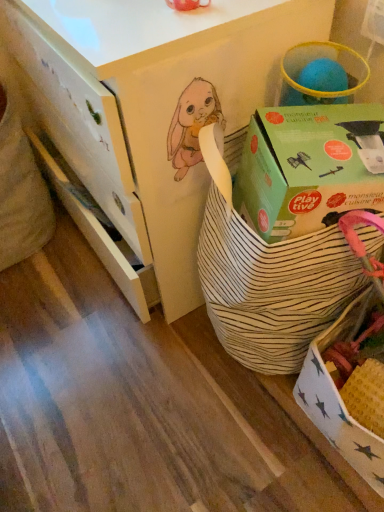
Question: Is white striped fabric basket at center oriented away from green cardboard box at upper right?

Choices:
 (A) yes
 (B) no

Answer: (B)

Question: Is white striped fabric basket at center completely or partially outside of green cardboard box at upper right?

Choices:
 (A) no
 (B) yes

Answer: (B)

Question: Considering the relative sizes of white striped fabric basket at center and green cardboard box at upper right in the image provided, is white striped fabric basket at center bigger than green cardboard box at upper right?

Choices:
 (A) yes
 (B) no

Answer: (A)

Question: Is white striped fabric basket at center smaller than green cardboard box at upper right?

Choices:
 (A) yes
 (B) no

Answer: (B)

Question: Is the depth of white striped fabric basket at center greater than that of green cardboard box at upper right?

Choices:
 (A) yes
 (B) no

Answer: (B)

Question: Is white striped basket at center spatially inside green cardboard box at upper right, or outside of it?

Choices:
 (A) inside
 (B) outside

Answer: (B)

Question: In the image, is white striped basket at center on the left side or the right side of green cardboard box at upper right?

Choices:
 (A) left
 (B) right

Answer: (A)

Question: From the image's perspective, is white striped basket at center located above or below green cardboard box at upper right?

Choices:
 (A) above
 (B) below

Answer: (A)

Question: Considering the positions of point (84, 94) and point (327, 155), is point (84, 94) closer or farther from the camera than point (327, 155)?

Choices:
 (A) closer
 (B) farther

Answer: (B)

Question: From a real-world perspective, relative to white striped basket at center, is white striped fabric basket at center vertically above or below?

Choices:
 (A) above
 (B) below

Answer: (B)

Question: Based on their sizes in the image, would you say white striped fabric basket at center is bigger or smaller than white striped basket at center?

Choices:
 (A) small
 (B) big

Answer: (A)

Question: From the image's perspective, is white striped fabric basket at center located above or below white striped basket at center?

Choices:
 (A) below
 (B) above

Answer: (A)

Question: Which is correct: white striped fabric basket at center is inside white striped basket at center, or outside of it?

Choices:
 (A) inside
 (B) outside

Answer: (B)

Question: Does point (359, 111) appear closer or farther from the camera than point (258, 265)?

Choices:
 (A) closer
 (B) farther

Answer: (A)

Question: From their relative heights in the image, would you say green cardboard box at upper right is taller or shorter than white striped fabric basket at center?

Choices:
 (A) short
 (B) tall

Answer: (A)